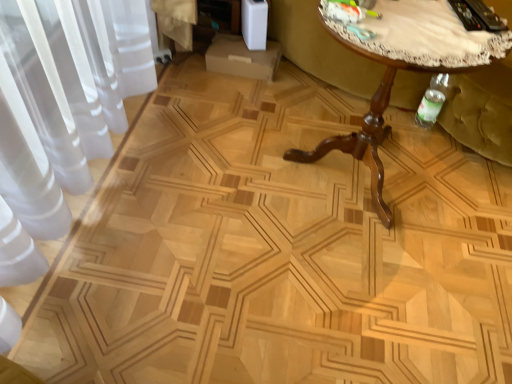
What do you see at coordinates (369, 122) in the screenshot? I see `brown wooden table at center` at bounding box center [369, 122].

Where is `brown wooden table at center`? brown wooden table at center is located at coordinates (369, 122).

At what (x,y) coordinates should I click in order to perform the action: click on green fabric swivel chair at right. Please return your answer as a coordinate pair (x, y). Looking at the image, I should click on (482, 110).

What do you see at coordinates (482, 110) in the screenshot? I see `green fabric swivel chair at right` at bounding box center [482, 110].

Where is `brown wooden table at center`? This screenshot has width=512, height=384. brown wooden table at center is located at coordinates (369, 122).

Considering the relative positions of green fabric swivel chair at right and brown wooden table at center in the image provided, is green fabric swivel chair at right to the left of brown wooden table at center from the viewer's perspective?

No, green fabric swivel chair at right is not to the left of brown wooden table at center.

Between green fabric swivel chair at right and brown wooden table at center, which one is positioned in front?

Positioned in front is brown wooden table at center.

Is point (456, 125) closer to camera compared to point (388, 225)?

No, (456, 125) is further to viewer.

In the scene shown: From the image's perspective, is green fabric swivel chair at right located beneath brown wooden table at center?

No.

From a real-world perspective, is green fabric swivel chair at right on top of brown wooden table at center?

Actually, green fabric swivel chair at right is physically below brown wooden table at center in the real world.

Considering the relative sizes of green fabric swivel chair at right and brown wooden table at center in the image provided, is green fabric swivel chair at right thinner than brown wooden table at center?

Incorrect, the width of green fabric swivel chair at right is not less than that of brown wooden table at center.

Considering the sizes of objects green fabric swivel chair at right and brown wooden table at center in the image provided, who is taller, green fabric swivel chair at right or brown wooden table at center?

Standing taller between the two is brown wooden table at center.

Looking at the image, does green fabric swivel chair at right seem bigger or smaller compared to brown wooden table at center?

green fabric swivel chair at right is smaller than brown wooden table at center.

Would you say green fabric swivel chair at right is inside or outside brown wooden table at center?

green fabric swivel chair at right is not inside brown wooden table at center, it's outside.

Is green fabric swivel chair at right in contact with brown wooden table at center?

They are not placed beside each other.

Is green fabric swivel chair at right turned away from brown wooden table at center?

No, brown wooden table at center is not at the back of green fabric swivel chair at right.

How different are the orientations of green fabric swivel chair at right and brown wooden table at center in degrees?

The facing directions of green fabric swivel chair at right and brown wooden table at center are 90 degrees apart.

Measure the distance from green fabric swivel chair at right to brown wooden table at center.

green fabric swivel chair at right and brown wooden table at center are 16.00 inches apart.

Identify the location of swivel chair below the brown wooden table at center (from a real-world perspective). The height and width of the screenshot is (384, 512). (482, 110).

Is brown wooden table at center to the right of green fabric swivel chair at right from the viewer's perspective?

In fact, brown wooden table at center is to the left of green fabric swivel chair at right.

Who is more distant, brown wooden table at center or green fabric swivel chair at right?

green fabric swivel chair at right is further from the camera.

Considering the positions of points (339, 139) and (451, 88), is point (339, 139) closer to camera compared to point (451, 88)?

Yes.

From the image's perspective, is brown wooden table at center beneath green fabric swivel chair at right?

Yes, from the image's perspective, brown wooden table at center is beneath green fabric swivel chair at right.

From a real-world perspective, is brown wooden table at center physically located above or below green fabric swivel chair at right?

brown wooden table at center is situated higher than green fabric swivel chair at right in the real world.

Looking at their sizes, would you say brown wooden table at center is wider or thinner than green fabric swivel chair at right?

Clearly, brown wooden table at center has less width compared to green fabric swivel chair at right.

Is brown wooden table at center taller or shorter than green fabric swivel chair at right?

Clearly, brown wooden table at center is taller compared to green fabric swivel chair at right.

Considering the sizes of brown wooden table at center and green fabric swivel chair at right in the image, is brown wooden table at center bigger or smaller than green fabric swivel chair at right?

brown wooden table at center is bigger than green fabric swivel chair at right.

Is brown wooden table at center not within green fabric swivel chair at right?

Absolutely, brown wooden table at center is external to green fabric swivel chair at right.

Is brown wooden table at center next to green fabric swivel chair at right?

No, brown wooden table at center is not beside green fabric swivel chair at right.

Is brown wooden table at center oriented away from green fabric swivel chair at right?

That's not correct — brown wooden table at center is not looking away from green fabric swivel chair at right.

Identify the location of table above the green fabric swivel chair at right (from a real-world perspective). This screenshot has width=512, height=384. (369, 122).

At what (x,y) coordinates should I click in order to perform the action: click on table in front of the green fabric swivel chair at right. Please return your answer as a coordinate pair (x, y). The image size is (512, 384). Looking at the image, I should click on pyautogui.click(x=369, y=122).

Image resolution: width=512 pixels, height=384 pixels. I want to click on table above the green fabric swivel chair at right (from a real-world perspective), so click(x=369, y=122).